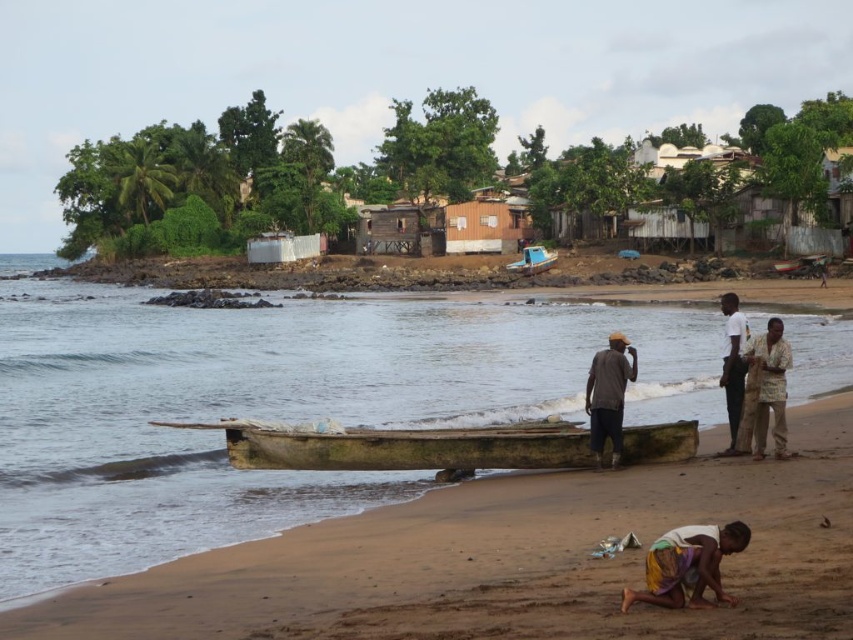
You are standing on the beach and want to walk from the wooden hut at center to the blue plastic boat at center. Which direction should you head?

Since the wooden hut at center is to the left of the blue plastic boat at center, you should head to the right to reach the boat.